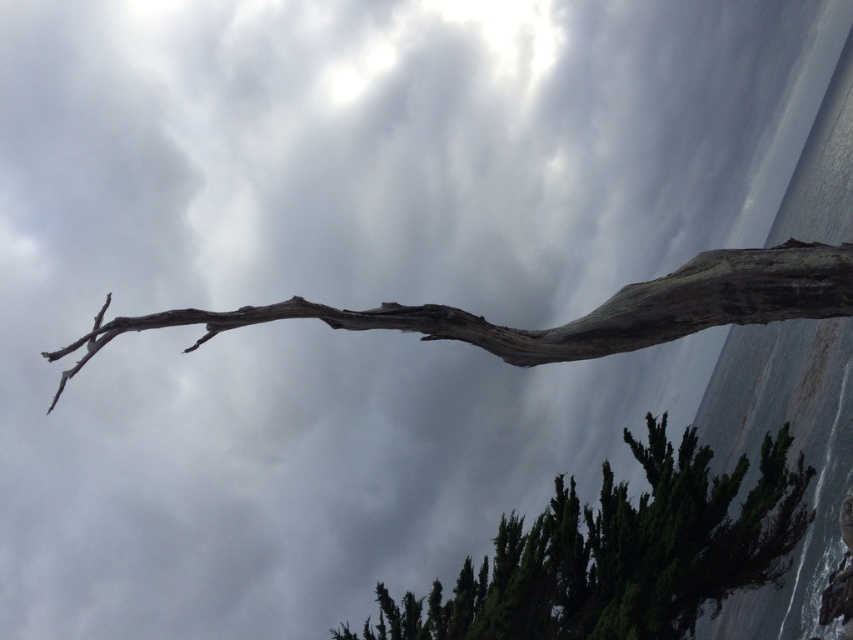
You are an arborist assessing the health of two trees in the scene. The dark green leafy tree at lower right and the gray rough bark branch at upper center. Which tree has a thicker branch?

The gray rough bark branch at upper center is thicker than the dark green leafy tree at lower right.

You are an observer standing in front of the scene. You notice the dark green leafy tree at lower right and the gray rough bark branch at upper center. Which object is positioned higher in the image?

The gray rough bark branch at upper center is positioned higher in the image than the dark green leafy tree at lower right.